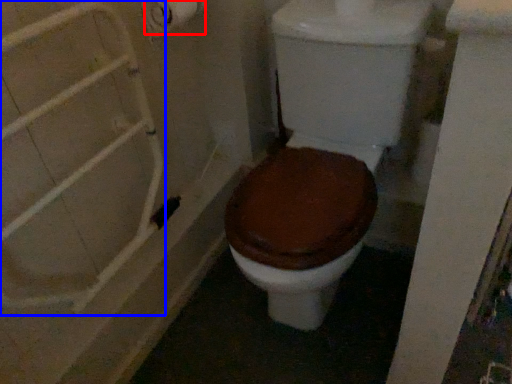
Question: Among these objects, which one is farthest to the camera, toilet paper (highlighted by a red box) or shower door (highlighted by a blue box)?

Choices:
 (A) toilet paper
 (B) shower door

Answer: (A)